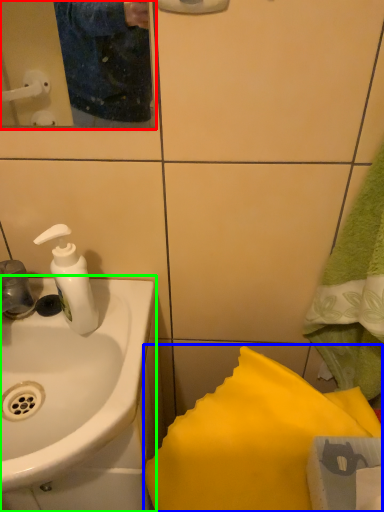
Question: Estimate the real-world distances between objects in this image. Which object is closer to mirror (highlighted by a red box), bath towel (highlighted by a blue box) or sink (highlighted by a green box)?

Choices:
 (A) bath towel
 (B) sink

Answer: (B)